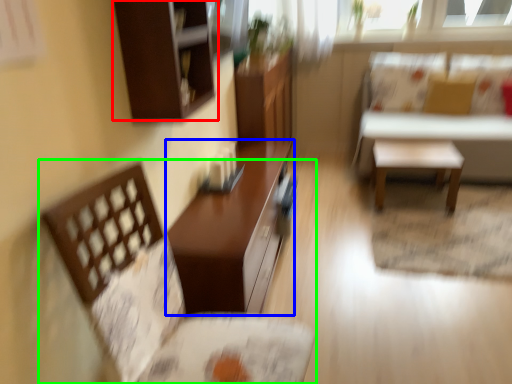
Question: Estimate the real-world distances between objects in this image. Which object is farther from cabinetry (highlighted by a red box), table (highlighted by a blue box) or chair (highlighted by a green box)?

Choices:
 (A) table
 (B) chair

Answer: (A)